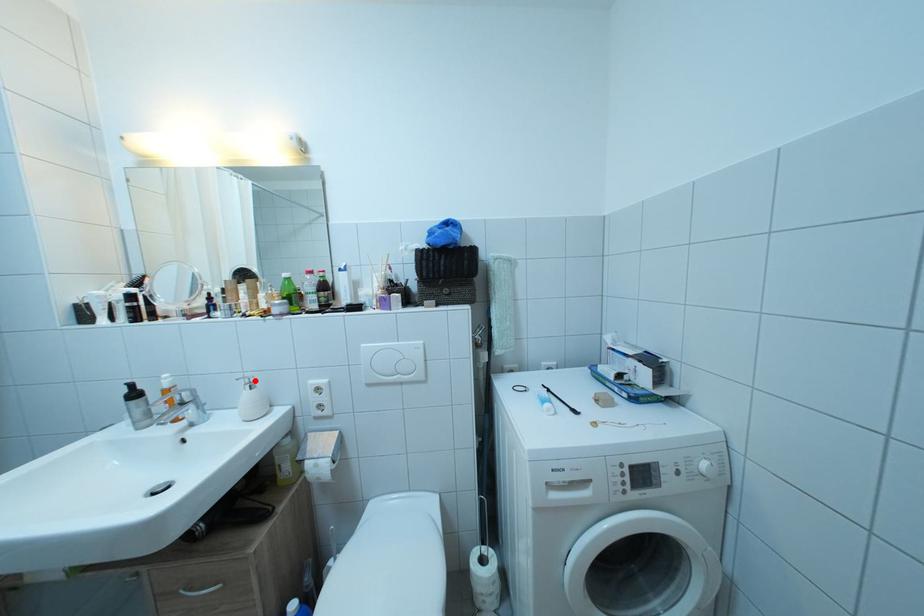
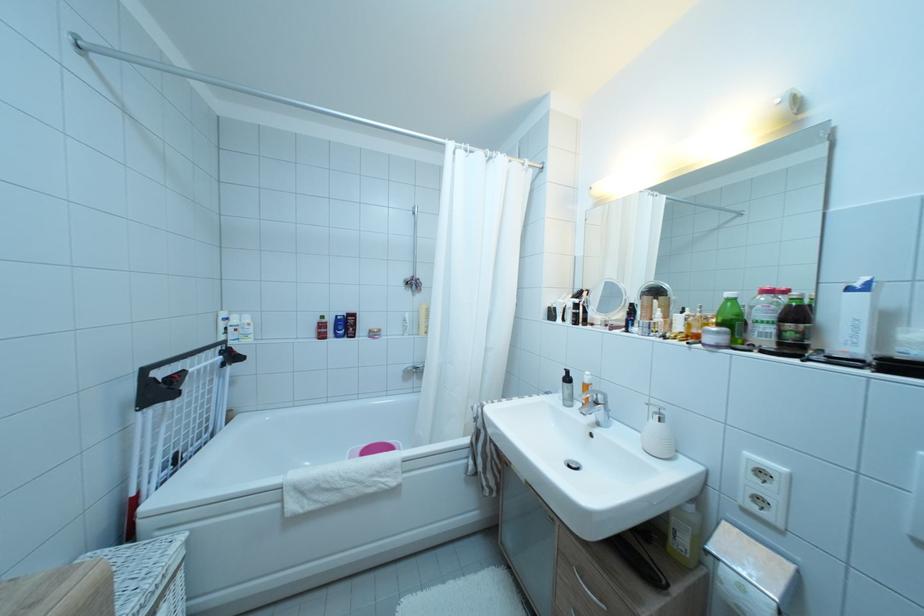
Question: I am providing you with two images of the same scene from different viewpoints. A red point is marked on the first image. Can you still see the location of the red point in image 2?

Choices:
 (A) Yes
 (B) No

Answer: (A)